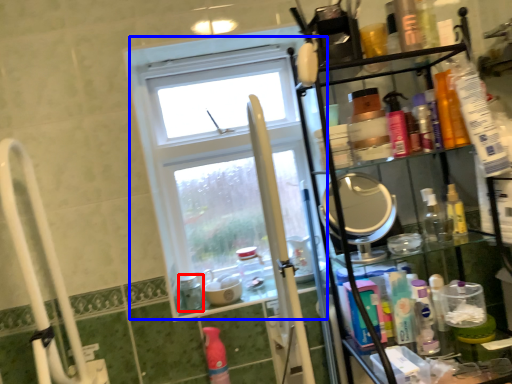
Question: Among these objects, which one is farthest to the camera, bottle (highlighted by a red box) or window (highlighted by a blue box)?

Choices:
 (A) bottle
 (B) window

Answer: (B)